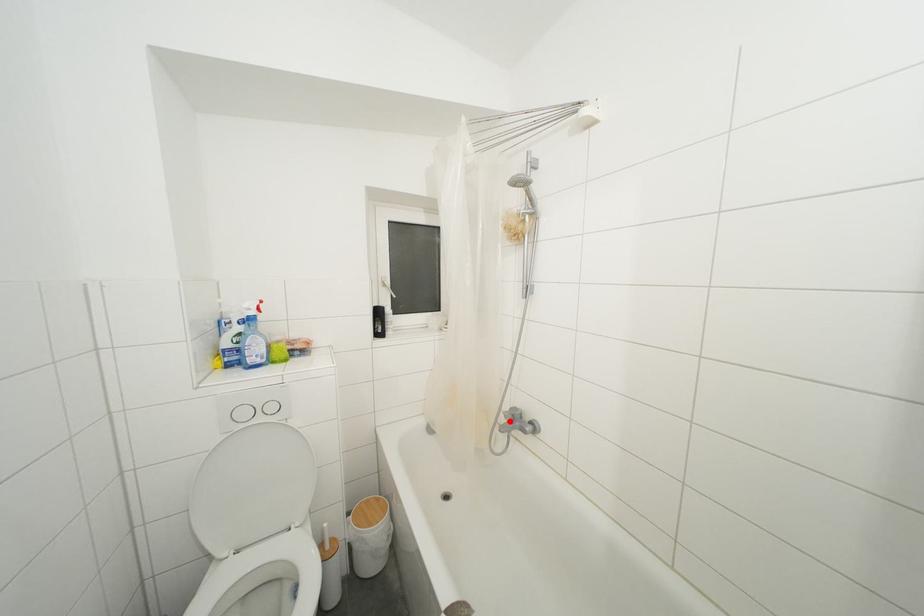
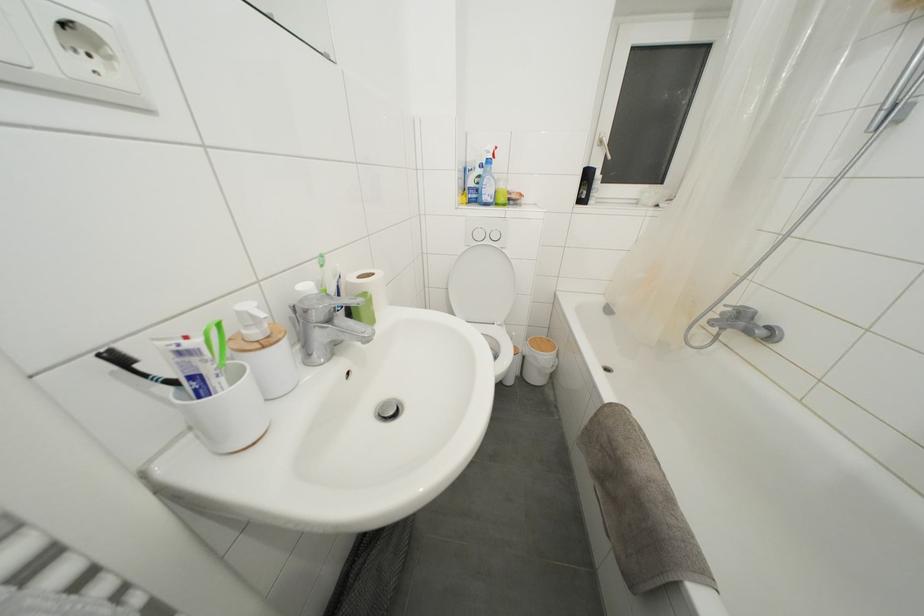
Locate, in the second image, the point that corresponds to the highlighted location in the first image.

(726, 318)